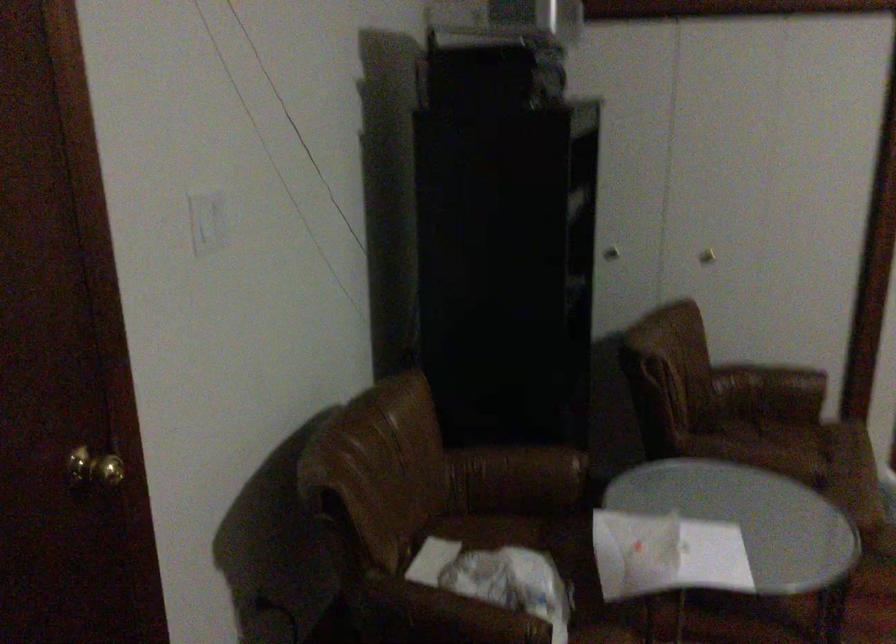
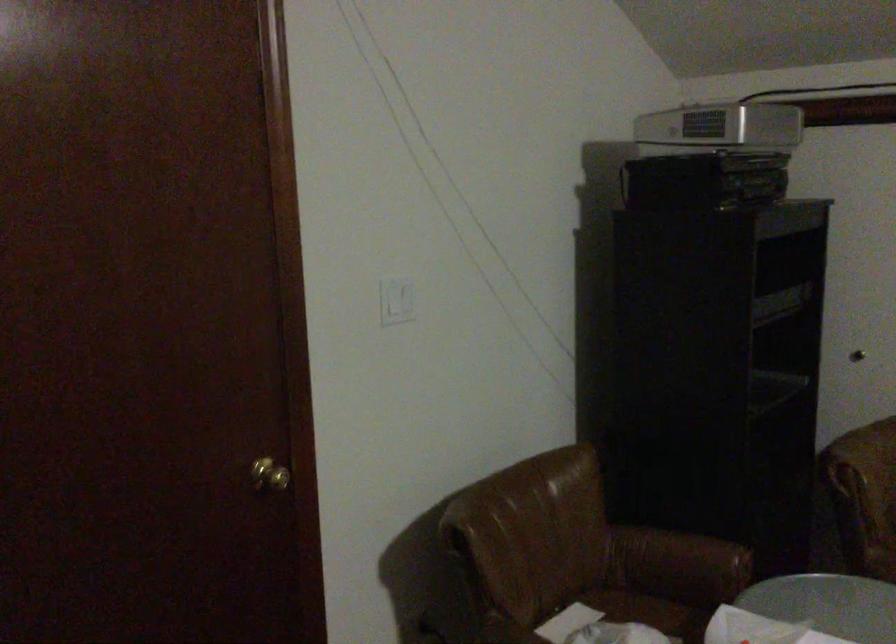
Find the pixel in the second image that matches the point at 521,471 in the first image.

(679, 559)